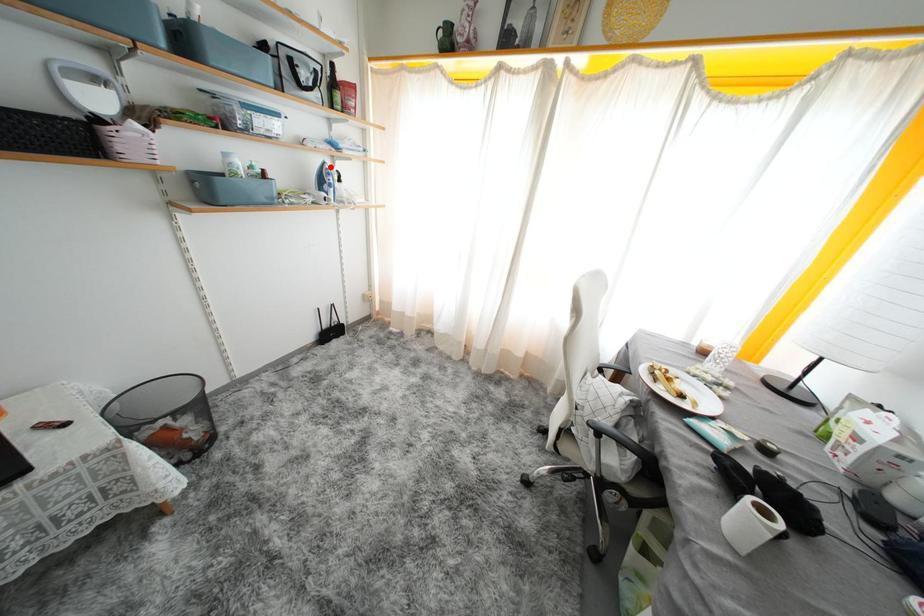
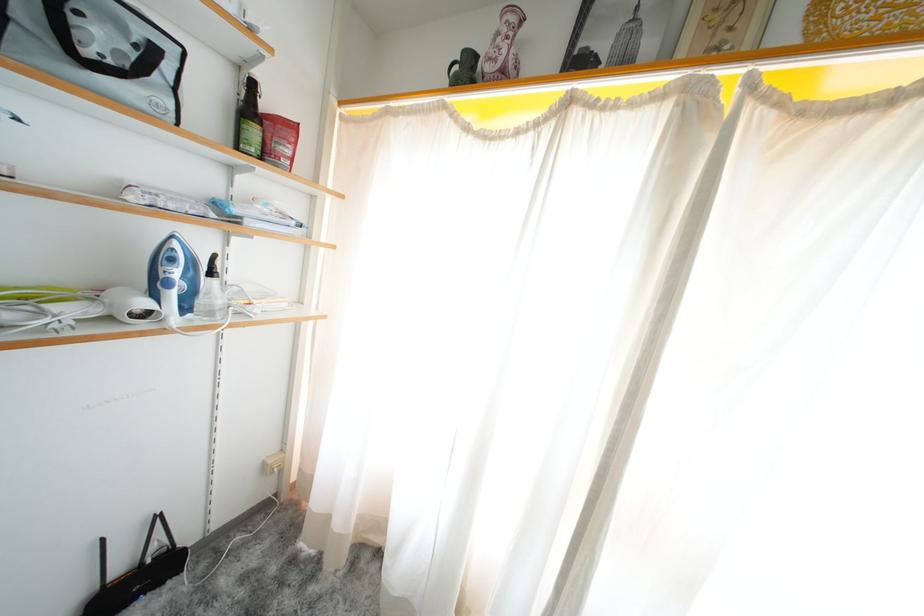
Locate, in the second image, the point that corresponds to the highlighted location in the first image.

(178, 241)